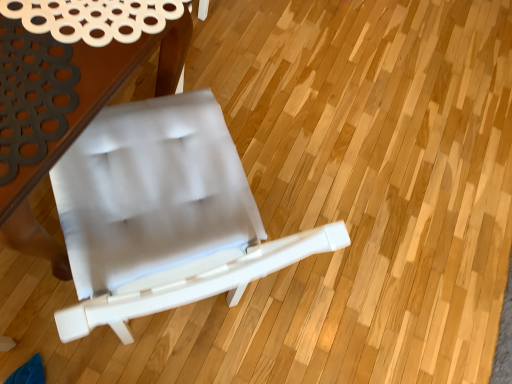
Question: From the image's perspective, is white fabric table at upper left on top of white fabric chair at center?

Choices:
 (A) yes
 (B) no

Answer: (A)

Question: Is white fabric table at upper left to the right of white fabric chair at center from the viewer's perspective?

Choices:
 (A) no
 (B) yes

Answer: (A)

Question: Considering the relative sizes of white fabric table at upper left and white fabric chair at center in the image provided, is white fabric table at upper left bigger than white fabric chair at center?

Choices:
 (A) yes
 (B) no

Answer: (A)

Question: From the image's perspective, is white fabric table at upper left beneath white fabric chair at center?

Choices:
 (A) yes
 (B) no

Answer: (B)

Question: Is white fabric chair at center located within white fabric table at upper left?

Choices:
 (A) yes
 (B) no

Answer: (B)

Question: Considering the relative sizes of white fabric table at upper left and white fabric chair at center in the image provided, is white fabric table at upper left shorter than white fabric chair at center?

Choices:
 (A) yes
 (B) no

Answer: (A)

Question: Can you confirm if white fabric chair at center is smaller than white fabric table at upper left?

Choices:
 (A) yes
 (B) no

Answer: (A)

Question: Is white fabric chair at center oriented towards white fabric table at upper left?

Choices:
 (A) yes
 (B) no

Answer: (A)

Question: Is white fabric chair at center further to the viewer compared to white fabric table at upper left?

Choices:
 (A) yes
 (B) no

Answer: (B)

Question: Is white fabric chair at center completely or partially outside of white fabric table at upper left?

Choices:
 (A) yes
 (B) no

Answer: (A)

Question: Does white fabric chair at center have a lesser width compared to white fabric table at upper left?

Choices:
 (A) no
 (B) yes

Answer: (B)

Question: From a real-world perspective, is white fabric chair at center over white fabric table at upper left?

Choices:
 (A) yes
 (B) no

Answer: (A)

Question: In the image, is white fabric chair at center positioned in front of or behind white fabric table at upper left?

Choices:
 (A) behind
 (B) front

Answer: (B)